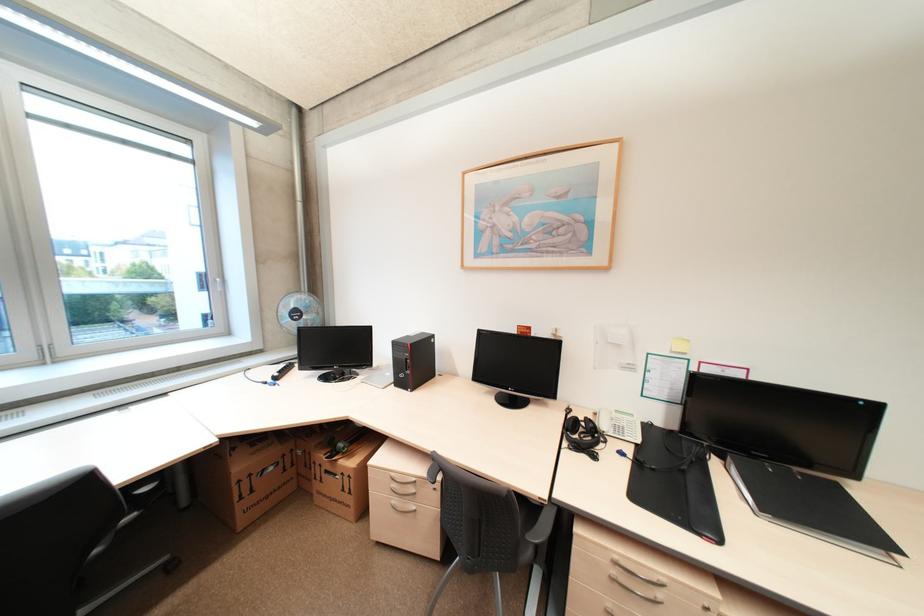
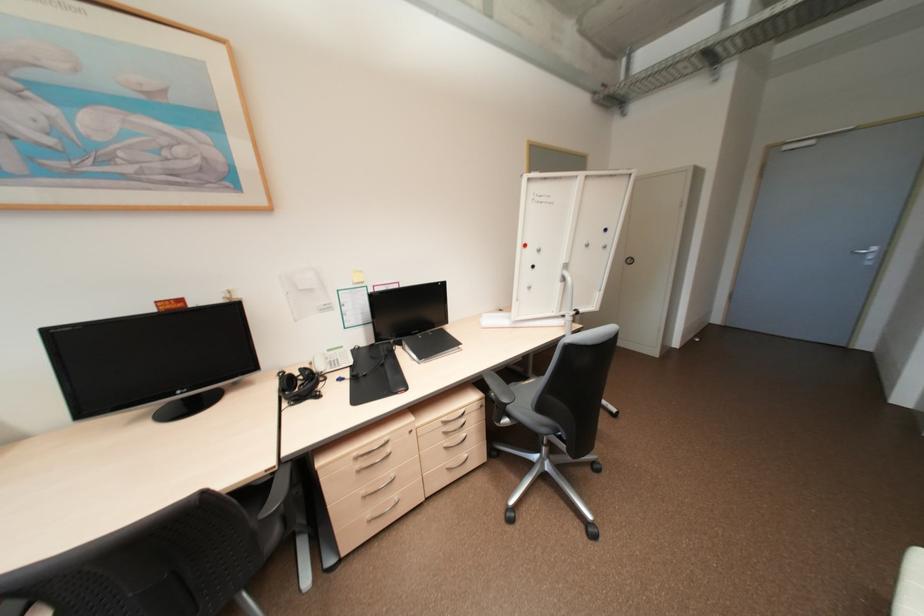
In the second image, find the point that corresponds to point 581,419 in the first image.

(297, 377)